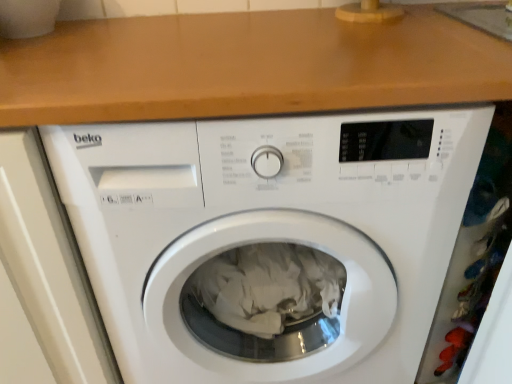
Question: Considering the positions of point (477, 52) and point (208, 243), is point (477, 52) closer or farther from the camera than point (208, 243)?

Choices:
 (A) closer
 (B) farther

Answer: (A)

Question: Looking at their shapes, would you say wooden at upper center is wider or thinner than white plastic washing machine at center?

Choices:
 (A) thin
 (B) wide

Answer: (A)

Question: Is wooden at upper center situated inside white plastic washing machine at center or outside?

Choices:
 (A) inside
 (B) outside

Answer: (B)

Question: Is white plastic washing machine at center wider or thinner than wooden at upper center?

Choices:
 (A) wide
 (B) thin

Answer: (A)

Question: In terms of height, does white plastic washing machine at center look taller or shorter compared to wooden at upper center?

Choices:
 (A) tall
 (B) short

Answer: (A)

Question: From a real-world perspective, is white plastic washing machine at center physically located above or below wooden at upper center?

Choices:
 (A) below
 (B) above

Answer: (A)

Question: Would you say white plastic washing machine at center is to the left or to the right of wooden at upper center in the picture?

Choices:
 (A) right
 (B) left

Answer: (A)